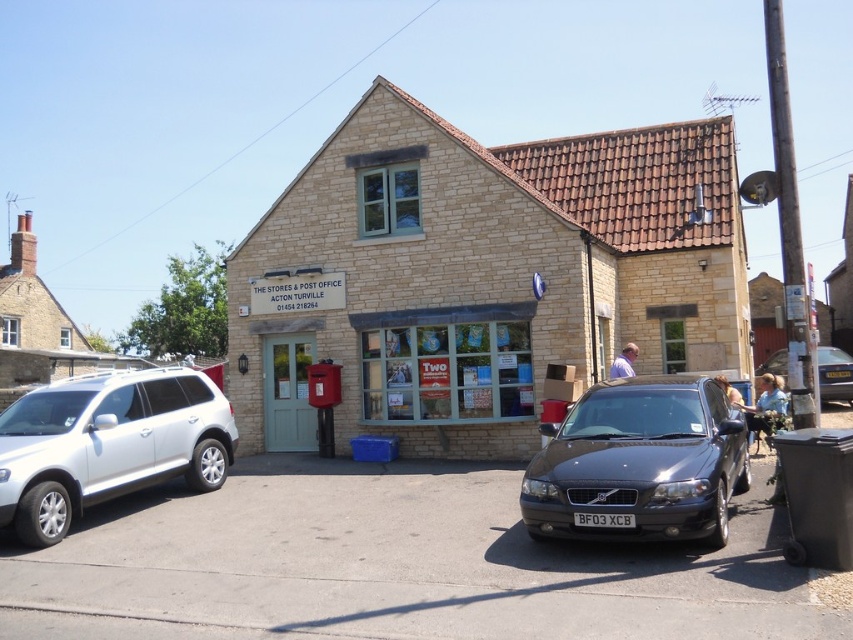
Question: Is metallic dark gray car at center above metallic gray sedan at center?

Choices:
 (A) no
 (B) yes

Answer: (A)

Question: Considering the real-world distances, which object is closest to the beige stone building at center?

Choices:
 (A) white matte suv at left
 (B) metallic dark gray car at center

Answer: (B)

Question: Observing the image, what is the correct spatial positioning of metallic dark gray car at center in reference to metallic gray sedan at center?

Choices:
 (A) right
 (B) left

Answer: (B)

Question: Can you confirm if beige stone building at center is positioned to the left of metallic dark gray car at center?

Choices:
 (A) yes
 (B) no

Answer: (A)

Question: Which point is closer to the camera?

Choices:
 (A) metallic dark gray car at center
 (B) white matte suv at left
 (C) beige stone building at center
 (D) metallic gray sedan at center

Answer: (A)

Question: Which object appears farthest from the camera in this image?

Choices:
 (A) metallic dark gray car at center
 (B) white matte suv at left
 (C) beige stone building at center

Answer: (C)